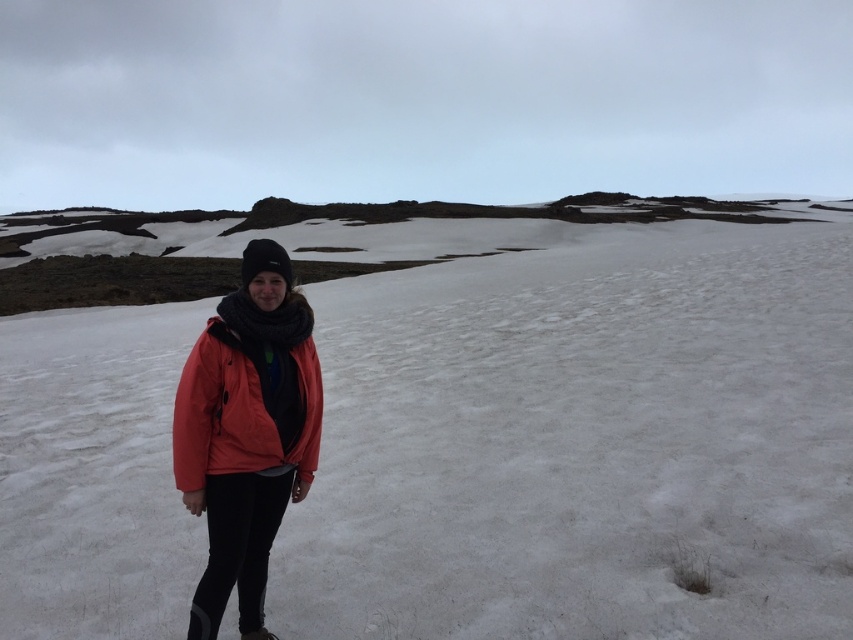
Question: In this image, where is white powdery snow at center located relative to matte orange jacket at center?

Choices:
 (A) below
 (B) above

Answer: (B)

Question: Is white powdery snow at center thinner than matte orange jacket at center?

Choices:
 (A) no
 (B) yes

Answer: (A)

Question: Is white powdery snow at center smaller than matte orange jacket at center?

Choices:
 (A) no
 (B) yes

Answer: (A)

Question: Which of the following is the closest to the observer?

Choices:
 (A) white powdery snow at center
 (B) matte orange jacket at center

Answer: (B)

Question: Which point is farther from the camera taking this photo?

Choices:
 (A) (753, 282)
 (B) (256, 458)

Answer: (A)